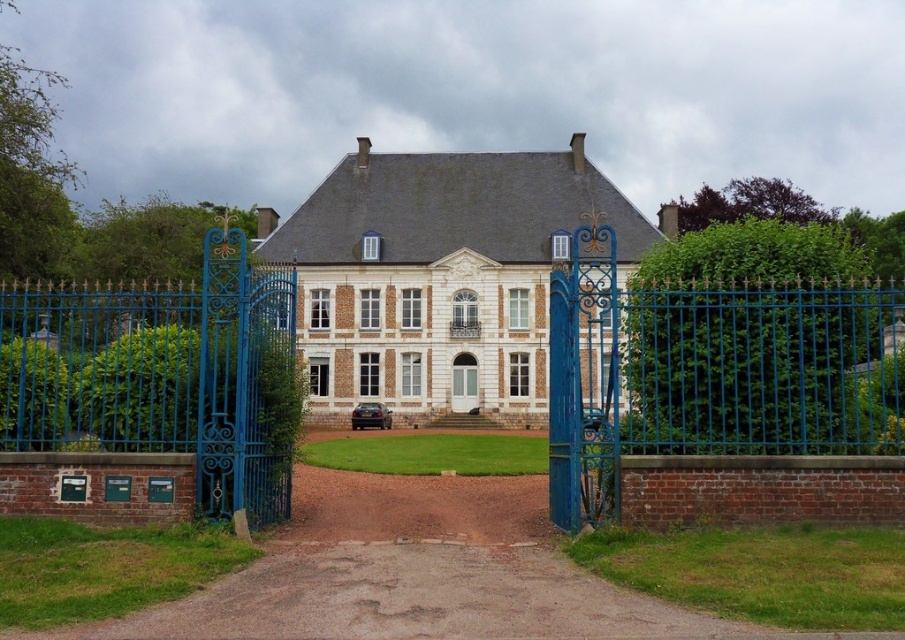
Does white brick mansion at center appear under white glossy door at center?

No.

Which is in front, point (302, 353) or point (465, 392)?

Point (465, 392) is in front.

Where is `white brick mansion at center`? white brick mansion at center is located at coordinates (439, 272).

Does blue wrought iron gate at center appear on the left side of white glossy door at center?

Incorrect, blue wrought iron gate at center is not on the left side of white glossy door at center.

Is point (837, 458) positioned before point (470, 392)?

That is True.

Is point (877, 355) positioned after point (470, 365)?

That is False.

Identify the location of blue wrought iron gate at center. Image resolution: width=905 pixels, height=640 pixels. (715, 362).

Is white glossy door at center smaller than matte white door at center?

Incorrect, white glossy door at center is not smaller in size than matte white door at center.

Which is below, white glossy door at center or matte white door at center?

white glossy door at center is lower down.

Who is more forward, (473, 400) or (322, 356)?

Point (473, 400)

The width and height of the screenshot is (905, 640). Find the location of `white glossy door at center`. white glossy door at center is located at coordinates (464, 381).